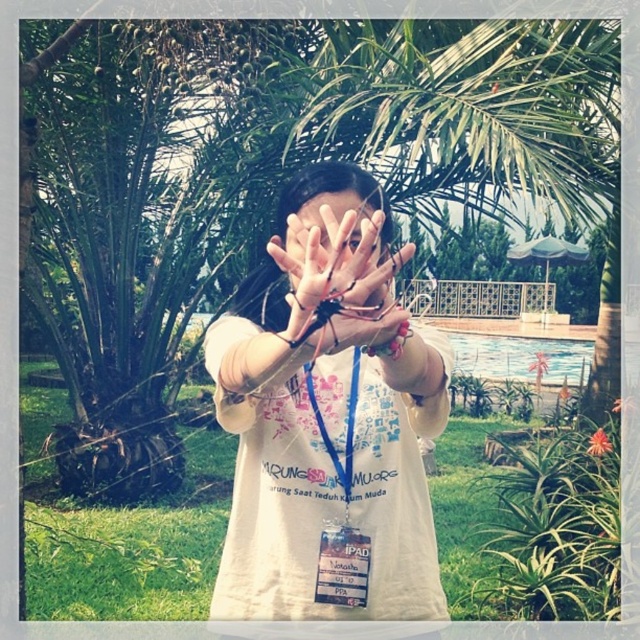
Question: Is white matte shirt at center positioned behind matte skin hand at center?

Choices:
 (A) yes
 (B) no

Answer: (A)

Question: Can you confirm if white matte shirt at center is positioned above matte skin hand at center?

Choices:
 (A) no
 (B) yes

Answer: (A)

Question: Which object is closer to the camera taking this photo?

Choices:
 (A) white matte shirt at center
 (B) green leafy palm tree at center

Answer: (A)

Question: Can you confirm if green leafy palm tree at center is smaller than white matte shirt at center?

Choices:
 (A) yes
 (B) no

Answer: (B)

Question: Which object appears closest to the camera in this image?

Choices:
 (A) green leafy palm tree at center
 (B) white matte shirt at center
 (C) matte skin hand at center

Answer: (C)

Question: Which object is closer to the camera taking this photo?

Choices:
 (A) white matte shirt at center
 (B) green leafy palm tree at center
 (C) matte skin hand at center

Answer: (C)